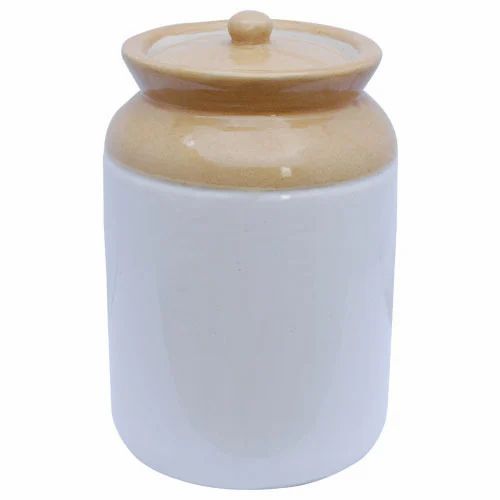
Where is `brown jar top`? The image size is (500, 500). brown jar top is located at coordinates (143, 132).